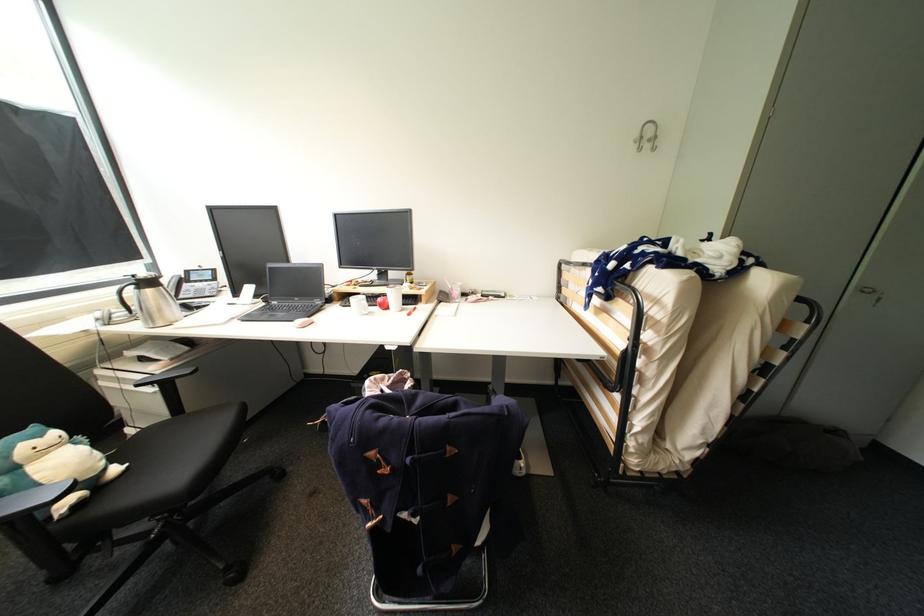
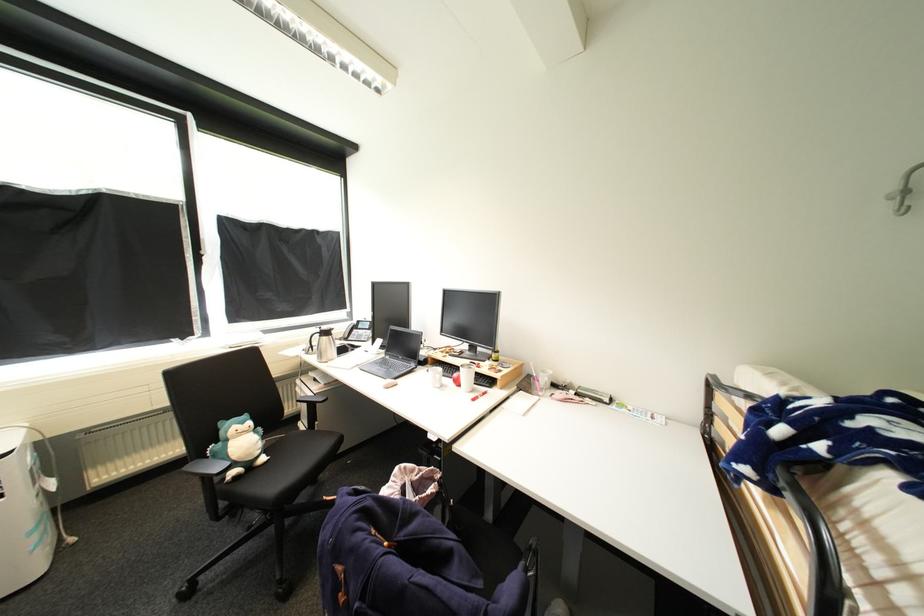
Where in the second image is the point corresponding to point (49, 438) from the first image?

(249, 424)